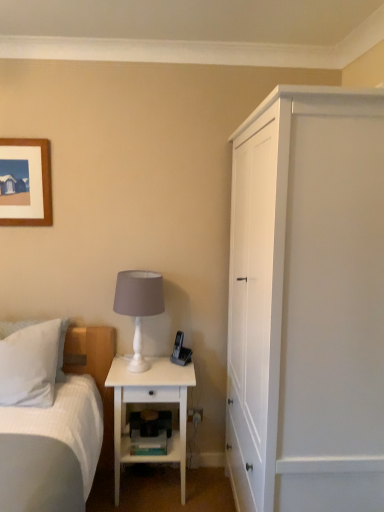
Question: Is white soft pillow at left beside white matte table lamp at center?

Choices:
 (A) no
 (B) yes

Answer: (A)

Question: From a real-world perspective, does white soft pillow at left stand above white matte table lamp at center?

Choices:
 (A) yes
 (B) no

Answer: (B)

Question: Would you say white soft pillow at left is a long distance from white matte table lamp at center?

Choices:
 (A) no
 (B) yes

Answer: (A)

Question: Is white soft pillow at left to the left of white matte table lamp at center from the viewer's perspective?

Choices:
 (A) yes
 (B) no

Answer: (A)

Question: Is white soft pillow at left wider than white matte table lamp at center?

Choices:
 (A) yes
 (B) no

Answer: (A)

Question: Can you confirm if white soft pillow at left is bigger than white matte table lamp at center?

Choices:
 (A) yes
 (B) no

Answer: (A)

Question: From the image's perspective, is white matte cabinet at right beneath white matte nightstand at lower center?

Choices:
 (A) no
 (B) yes

Answer: (A)

Question: Is white matte cabinet at right to the left of white matte nightstand at lower center from the viewer's perspective?

Choices:
 (A) yes
 (B) no

Answer: (B)

Question: Does white matte cabinet at right have a lesser width compared to white matte nightstand at lower center?

Choices:
 (A) yes
 (B) no

Answer: (B)

Question: Is the depth of white matte cabinet at right greater than that of white matte nightstand at lower center?

Choices:
 (A) no
 (B) yes

Answer: (A)

Question: From a real-world perspective, is white matte cabinet at right positioned under white matte nightstand at lower center based on gravity?

Choices:
 (A) no
 (B) yes

Answer: (A)

Question: Is white matte nightstand at lower center surrounded by white matte cabinet at right?

Choices:
 (A) no
 (B) yes

Answer: (A)

Question: Is white matte table lamp at center smaller than white soft pillow at left?

Choices:
 (A) yes
 (B) no

Answer: (A)